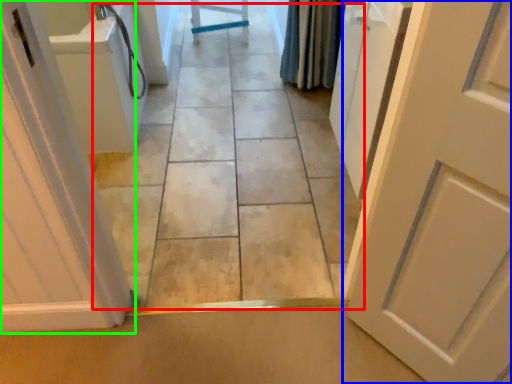
Question: Based on their relative distances, which object is farther from path (highlighted by a red box)? Choose from door (highlighted by a blue box) and door (highlighted by a green box).

Choices:
 (A) door
 (B) door

Answer: (A)